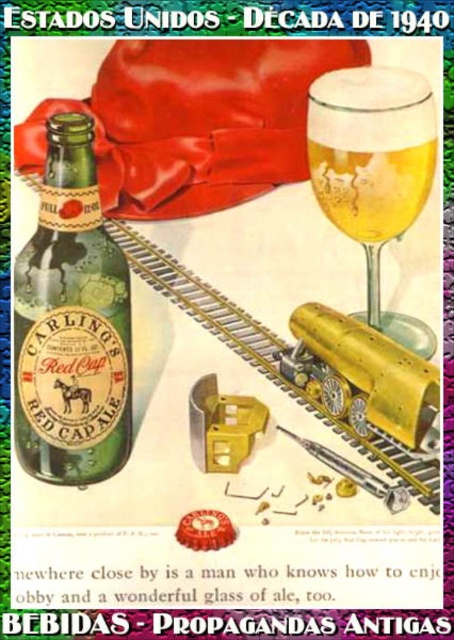
The height and width of the screenshot is (640, 454). I want to click on translucent glass beer at upper right, so click(374, 170).

Based on the photo, who is lower down, translucent glass beer at upper right or translucent glass champagne at upper right?

Positioned lower is translucent glass beer at upper right.

This screenshot has height=640, width=454. I want to click on translucent glass beer at upper right, so click(x=374, y=170).

You are a GUI agent. You are given a task and a screenshot of the screen. Output one action in this format:
    pyautogui.click(x=<x>, y=<y>)
    Task: Click on the translucent glass beer at upper right
    The image size is (454, 640).
    Given the screenshot: What is the action you would take?
    pyautogui.click(x=374, y=170)

Who is lower down, green glass bottle at left or translucent glass beer at upper right?

green glass bottle at left is lower down.

Is point (113, 246) positioned behind point (325, 86)?

Yes, point (113, 246) is farther from viewer.

Where is `green glass bottle at left`? Image resolution: width=454 pixels, height=640 pixels. green glass bottle at left is located at coordinates (72, 323).

Between green glass bottle at left and translucent glass champagne at upper right, which one is positioned higher?

translucent glass champagne at upper right is higher up.

This screenshot has width=454, height=640. What do you see at coordinates (72, 323) in the screenshot?
I see `green glass bottle at left` at bounding box center [72, 323].

Locate an element on the screen. This screenshot has width=454, height=640. green glass bottle at left is located at coordinates (72, 323).